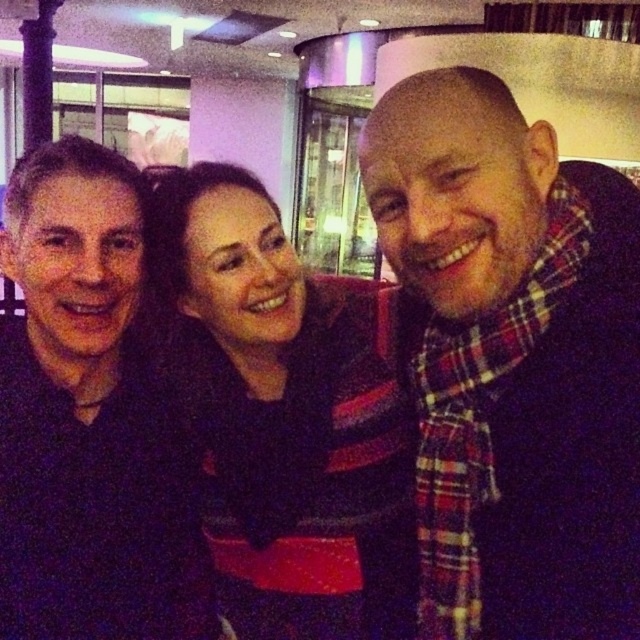
You are at a restaurant and want to hand a menu to the person wearing the black knitwear at center without disturbing the person in the dark blue shirt at left. Which direction should you approach from?

You should approach from the side of the black knitwear at center that is closer to you since it is further to the viewer than the dark blue shirt at left, meaning there is space between them to reach without disturbing the left person.

You are trying to decide which item is shorter between the plaid scarf at right and the black knitwear at center. Based on the scene description, which one is shorter?

The plaid scarf at right is shorter than the black knitwear at center.

You are standing 30 inches away from the glass door in the background of the image. A point at coordinates point (497, 164) is located somewhere in the scene. Can you reach this point without moving closer than 28 inches to the glass door?

The distance of point (497, 164) from viewer is 28.33 inches. Since you are currently 30 inches away from the glass door, you can reach the point as it is within your 28 inches proximity requirement.